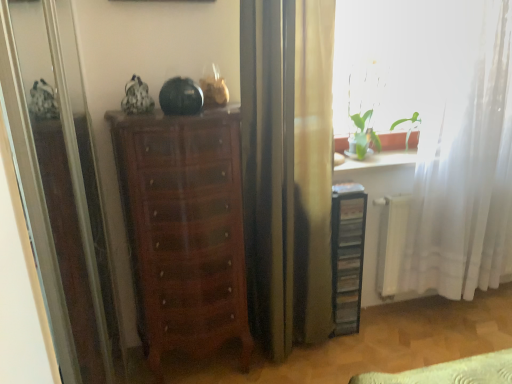
Locate an element on the screen. free space above shiny brown chest of drawers at center (from a real-world perspective) is located at coordinates (184, 114).